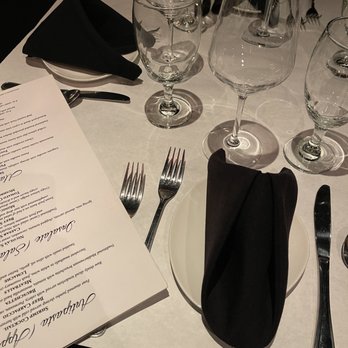
This screenshot has height=348, width=348. I want to click on butter knife, so point(110,93), point(322,220).